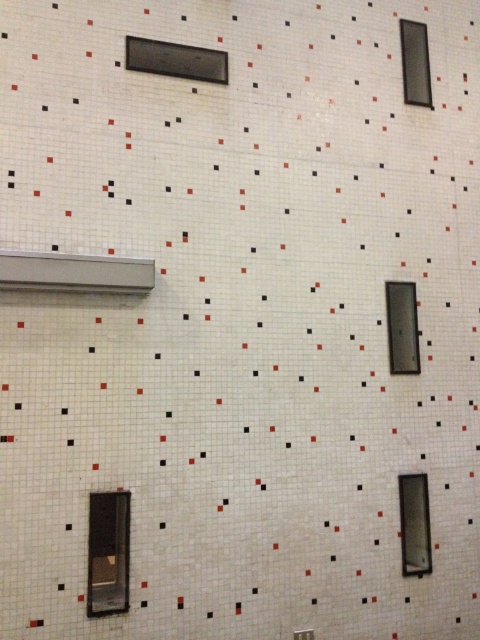
Based on the photo, between clear glass window at lower right and transparent glass window at center, which one has less height?

transparent glass window at center is shorter.

Is clear glass window at lower right behind transparent glass window at center?

No.

Identify the location of clear glass window at lower right. The image size is (480, 640). (415, 524).

Can you confirm if matte black window at upper center is bigger than clear glass window at lower right?

Indeed, matte black window at upper center has a larger size compared to clear glass window at lower right.

Does point (131, 36) come closer to viewer compared to point (407, 508)?

Yes, it is in front of point (407, 508).

Is point (222, 60) positioned before point (417, 563)?

Yes.

This screenshot has width=480, height=640. In order to click on matte black window at upper center in this screenshot , I will do `click(176, 60)`.

What do you see at coordinates (176, 60) in the screenshot? The width and height of the screenshot is (480, 640). I see `matte black window at upper center` at bounding box center [176, 60].

Between matte black window at upper center and transparent glass window at center, which one is positioned higher?

matte black window at upper center is above.

This screenshot has width=480, height=640. Describe the element at coordinates (176, 60) in the screenshot. I see `matte black window at upper center` at that location.

Image resolution: width=480 pixels, height=640 pixels. What are the coordinates of `matte black window at upper center` in the screenshot? It's located at (176, 60).